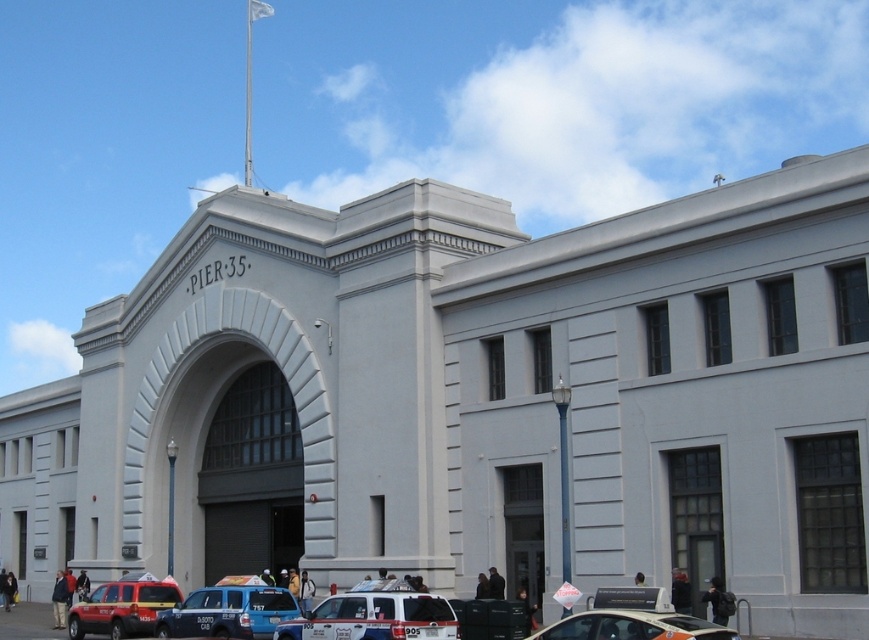
You are a delivery person who needs to park your white glossy van at lower center and blue metallic van at lower center in the parking lot behind Pier 35. The parking spots are exactly the same length as the vehicles. Which van should you park first to ensure both fit in their respective spots?

The white glossy van at lower center is shorter than the blue metallic van at lower center, so you should park the white glossy van at lower center first in its shorter spot, and the blue metallic van at lower center in the longer spot.

You are standing in front of Pier 35 and notice a white glossy van at lower center and a matte red suv at lower left. Which vehicle is positioned higher relative to the other?

The white glossy van at lower center is located above the matte red suv at lower left.

You are driving a white glossy car at lower right and want to exit the parking lot. The white glossy van at lower center is blocking your path. Can you safely move around the van to exit?

The white glossy car at lower right is behind the white glossy van at lower center, so you can safely move around the van to exit by going either left or right of it, provided there is enough space.